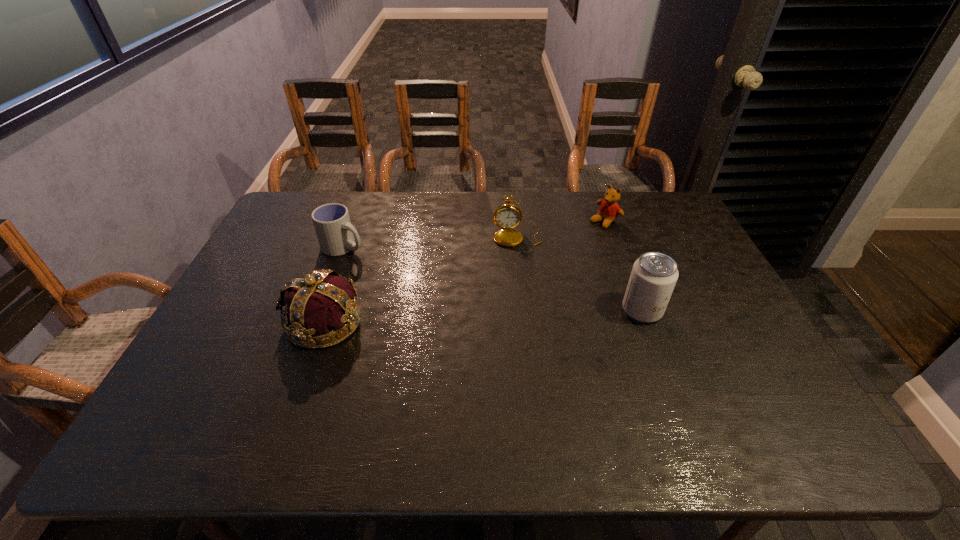
At what (x,y) coordinates should I click in order to perform the action: click on vacant region located with the handle on the side of the cup. Please return your answer as a coordinate pair (x, y). The image size is (960, 540). Looking at the image, I should click on (374, 259).

The width and height of the screenshot is (960, 540). I want to click on vacant space located with the handle on the side of the cup, so click(x=420, y=281).

You are a GUI agent. You are given a task and a screenshot of the screen. Output one action in this format:
    pyautogui.click(x=<x>, y=<y>)
    Task: Click on the vacant point located 0.380m with the handle on the side of the cup
    
    Given the screenshot: What is the action you would take?
    pyautogui.click(x=457, y=299)

In order to click on vacant position located 0.340m on the front-facing side of the teddy bear in this screenshot , I will do pyautogui.click(x=528, y=272).

The height and width of the screenshot is (540, 960). Find the location of `free space located 0.250m on the front-facing side of the teddy bear`. free space located 0.250m on the front-facing side of the teddy bear is located at coordinates (547, 259).

Identify the location of free space located on the front-facing side of the teddy bear. The height and width of the screenshot is (540, 960). (518, 279).

In order to click on pocket watch present at the far edge in this screenshot , I will do `click(507, 216)`.

Locate an element on the screen. teddy bear present at the far edge is located at coordinates (609, 210).

I want to click on vacant space at the far edge of the desktop, so click(x=384, y=193).

At what (x,y) coordinates should I click in order to perform the action: click on vacant space at the near edge of the desktop. Please return your answer as a coordinate pair (x, y). This screenshot has height=540, width=960. Looking at the image, I should click on (481, 391).